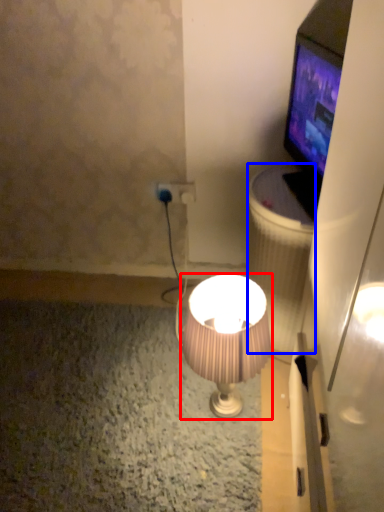
Question: Which of the following is the closest to the observer, lamp (highlighted by a red box) or trash bin/can (highlighted by a blue box)?

Choices:
 (A) lamp
 (B) trash bin/can

Answer: (A)